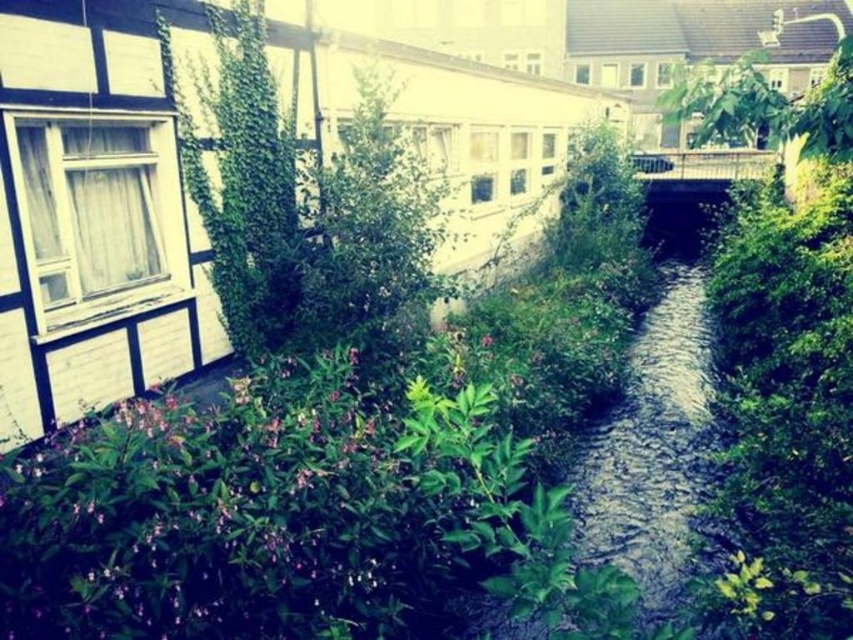
You are planning to place a small garden bench between the green leafy plant at upper left and the clear water stream at center. Which object should the bench be closer to if you want it to be near the narrower one?

The green leafy plant at upper left has a lesser width compared to the clear water stream at center, so the bench should be placed closer to the green leafy plant at upper left to be near the narrower one.

You are a gardener standing near the green leafy plant at upper left and want to water the clear water stream at center. Can you reach the stream with a standard garden hose that has a maximum reach of 4 meters?

The distance between the green leafy plant at upper left and the clear water stream at center is 4.05 meters, which is slightly longer than the garden hose can reach. You will need to move closer or use a longer hose to water the stream.